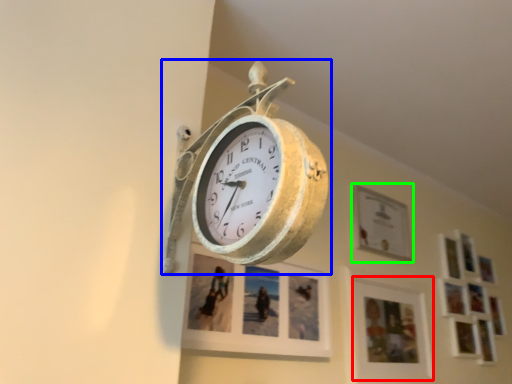
Question: Based on their relative distances, which object is nearer to picture frame (highlighted by a red box)? Choose from wall clock (highlighted by a blue box) and picture frame (highlighted by a green box).

Choices:
 (A) wall clock
 (B) picture frame

Answer: (B)